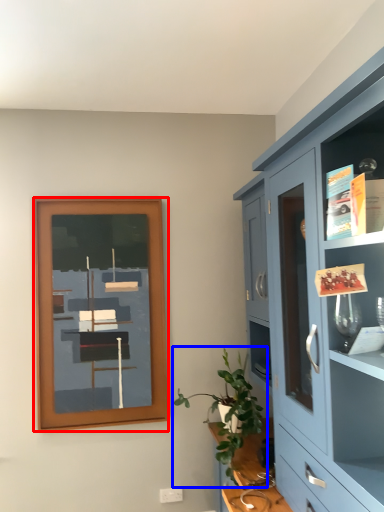
Question: Which point is closer to the camera, picture frame (highlighted by a red box) or houseplant (highlighted by a blue box)?

Choices:
 (A) picture frame
 (B) houseplant

Answer: (B)